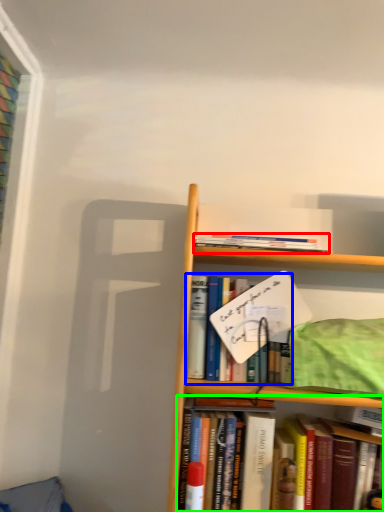
Question: Which object is the farthest from book (highlighted by a red box)? Choose among these: book (highlighted by a blue box) or book (highlighted by a green box).

Choices:
 (A) book
 (B) book

Answer: (B)